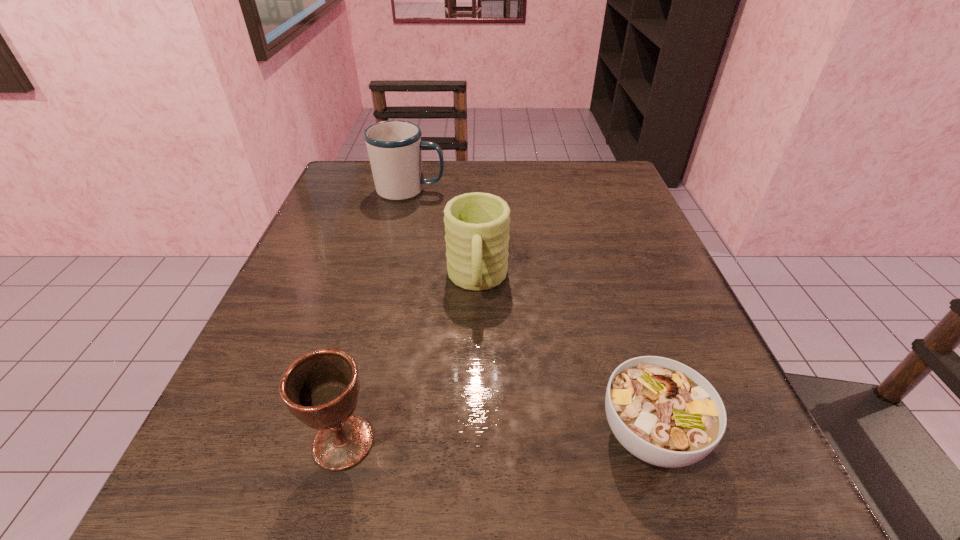
In order to click on vacant point located on the back of the shortest object in this screenshot , I will do `click(609, 302)`.

The image size is (960, 540). Find the location of `object that is positioned at the far edge`. object that is positioned at the far edge is located at coordinates (394, 147).

Identify the location of chalice located at the near edge. Image resolution: width=960 pixels, height=540 pixels. (320, 388).

Find the location of a particular element. soup bowl situated at the near edge is located at coordinates (663, 412).

At what (x,y) coordinates should I click in order to perform the action: click on mug positioned at the left edge. Please return your answer as a coordinate pair (x, y). Looking at the image, I should click on (394, 147).

Find the location of a particular element. This screenshot has height=540, width=960. chalice situated at the left edge is located at coordinates (320, 388).

The height and width of the screenshot is (540, 960). In order to click on object that is at the right edge in this screenshot , I will do `click(663, 412)`.

Where is `object that is at the far left corner`? This screenshot has width=960, height=540. object that is at the far left corner is located at coordinates (394, 147).

The height and width of the screenshot is (540, 960). I want to click on object at the near left corner, so click(x=320, y=388).

The image size is (960, 540). I want to click on object located at the near right corner, so click(663, 412).